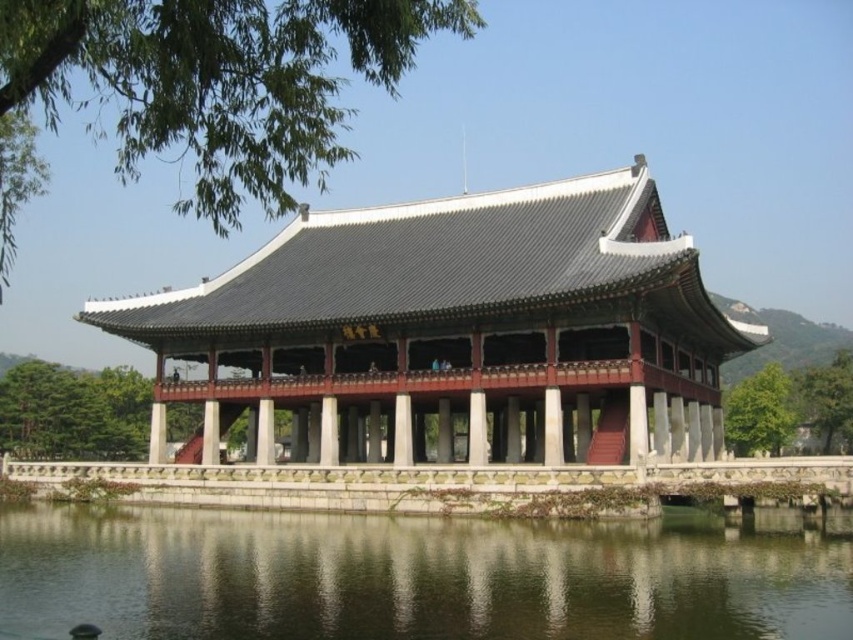
Does point (488, 396) come behind point (35, 602)?

Yes, it is.

Is matte gray stone palace at center shorter than transparent water at lower center?

Incorrect, matte gray stone palace at center's height does not fall short of transparent water at lower center's.

Image resolution: width=853 pixels, height=640 pixels. Identify the location of matte gray stone palace at center. (456, 330).

I want to click on matte gray stone palace at center, so click(x=456, y=330).